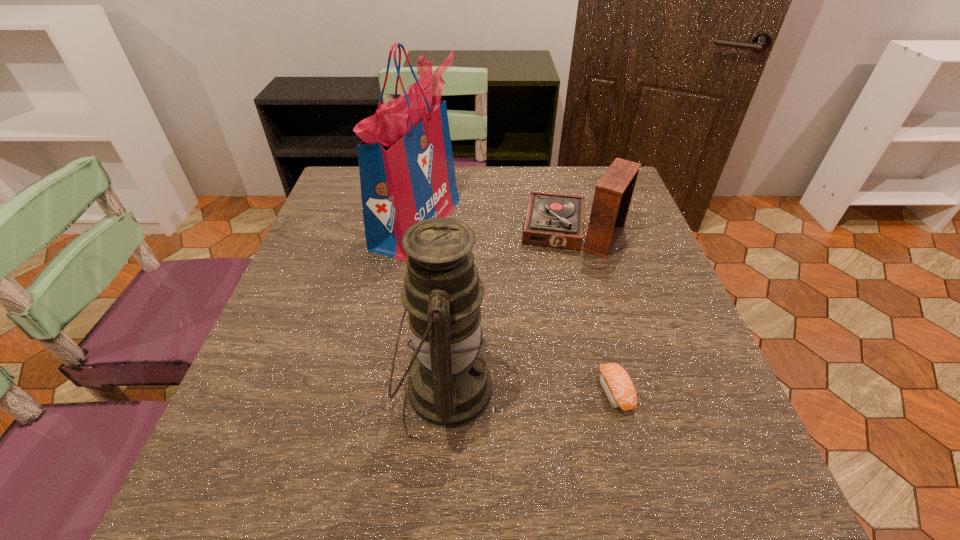
The height and width of the screenshot is (540, 960). Find the location of `vacant area that lies between the third shortest object and the phonograph record`. vacant area that lies between the third shortest object and the phonograph record is located at coordinates (510, 311).

Locate an element on the screen. empty space that is in between the shortest object and the oil lamp is located at coordinates (530, 390).

The image size is (960, 540). Find the location of `unoccupied position between the phonograph record and the grocery bag`. unoccupied position between the phonograph record and the grocery bag is located at coordinates (495, 228).

The height and width of the screenshot is (540, 960). In order to click on vacant point located between the third shortest object and the phonograph record in this screenshot , I will do `click(510, 311)`.

At what (x,y) coordinates should I click in order to perform the action: click on vacant area between the phonograph record and the shortest object. Please return your answer as a coordinate pair (x, y). Looking at the image, I should click on (594, 313).

Select which object appears as the closest to the grocery bag. Please provide its 2D coordinates. Your answer should be formatted as a tuple, i.e. [(x, y)], where the tuple contains the x and y coordinates of a point satisfying the conditions above.

[(554, 220)]

Identify which object is located as the third nearest to the sushi. Please provide its 2D coordinates. Your answer should be formatted as a tuple, i.e. [(x, y)], where the tuple contains the x and y coordinates of a point satisfying the conditions above.

[(406, 166)]

What are the coordinates of `vacant area in the image that satisfies the following two spatial constraints: 1. on the back side of the second shortest object; 2. on the front-facing side of the grocery bag` in the screenshot? It's located at (571, 223).

The width and height of the screenshot is (960, 540). I want to click on free region that satisfies the following two spatial constraints: 1. on the front-facing side of the tallest object; 2. on the back side of the second shortest object, so click(415, 234).

You are a GUI agent. You are given a task and a screenshot of the screen. Output one action in this format:
    pyautogui.click(x=<x>, y=<y>)
    Task: Click on the free location that satisfies the following two spatial constraints: 1. on the front-facing side of the tallest object; 2. on the left side of the second shortest object
    The image size is (960, 540).
    Given the screenshot: What is the action you would take?
    pyautogui.click(x=415, y=234)